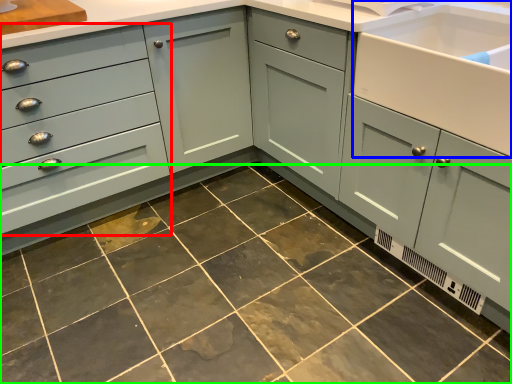
Question: Which object is positioned closest to drawer (highlighted by a red box)? Select from sink (highlighted by a blue box) and ceramic tile (highlighted by a green box).

Choices:
 (A) sink
 (B) ceramic tile

Answer: (B)